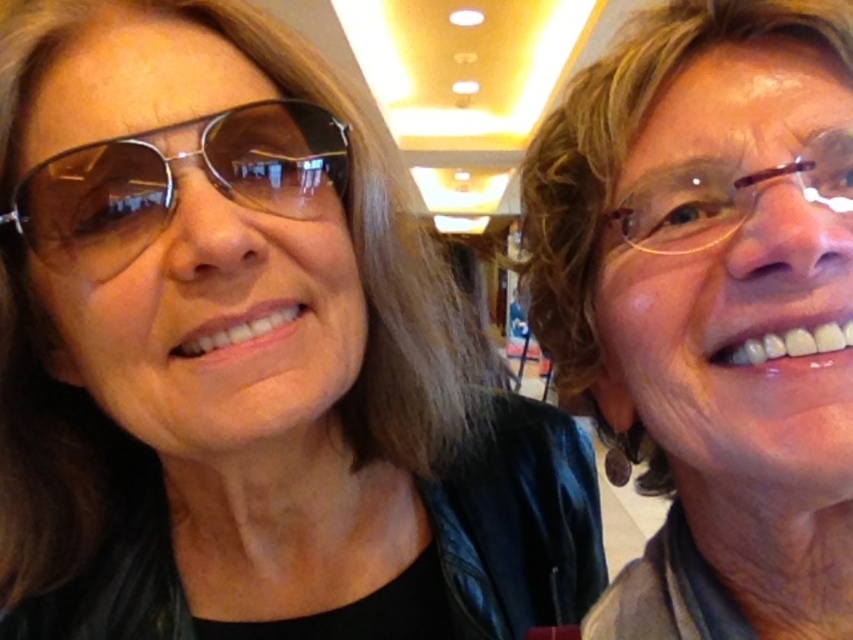
Does matte black sunglasses at upper left have a lesser width compared to sunglasses at left?

Incorrect, matte black sunglasses at upper left's width is not less than sunglasses at left's.

How much distance is there between matte black sunglasses at upper left and sunglasses at left?

The distance of matte black sunglasses at upper left from sunglasses at left is 5.31 inches.

Between point (287, 45) and point (276, 193), which one is positioned in front?

Point (276, 193) is in front.

Image resolution: width=853 pixels, height=640 pixels. What are the coordinates of `matte black sunglasses at upper left` in the screenshot? It's located at (245, 360).

Can you confirm if matte black sunglasses at upper left is positioned above matte black jacket at right?

Actually, matte black sunglasses at upper left is below matte black jacket at right.

Is point (166, 154) closer to viewer compared to point (766, 216)?

No.

This screenshot has width=853, height=640. Identify the location of matte black sunglasses at upper left. (245, 360).

Is the position of matte black sunglasses at upper left more distant than that of brown plastic glasses at right?

Yes, it is.

Can you confirm if matte black sunglasses at upper left is wider than brown plastic glasses at right?

Indeed, matte black sunglasses at upper left has a greater width compared to brown plastic glasses at right.

Identify the location of matte black sunglasses at upper left. The width and height of the screenshot is (853, 640). (245, 360).